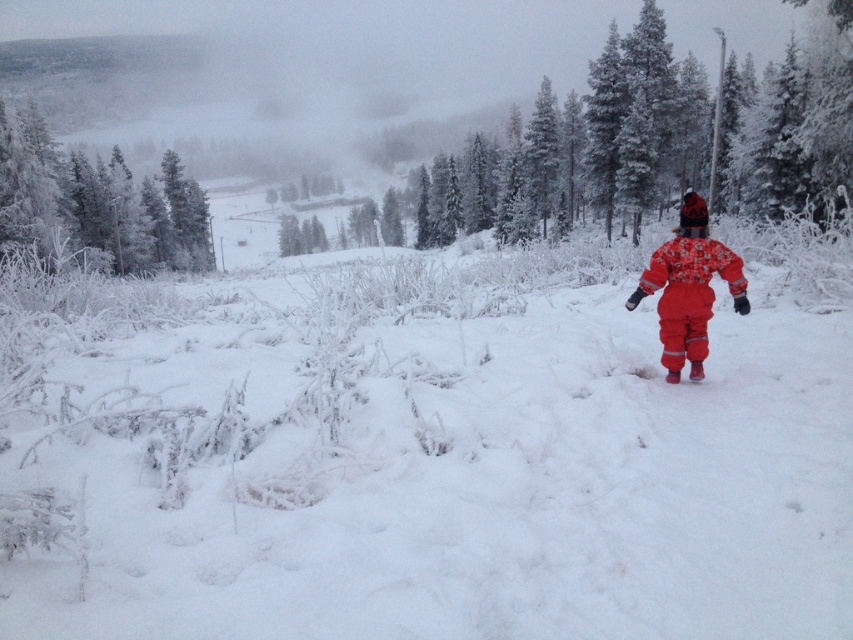
Question: Among these objects, which one is nearest to the camera?

Choices:
 (A) white fluffy snow at center
 (B) fluffy red snowsuit at right
 (C) frosted pine trees at left

Answer: (A)

Question: Does frosted pine trees at left appear under fluffy red snowsuit at right?

Choices:
 (A) no
 (B) yes

Answer: (A)

Question: Is white fluffy snow at center positioned behind frosted pine trees at left?

Choices:
 (A) no
 (B) yes

Answer: (A)

Question: Among these objects, which one is nearest to the camera?

Choices:
 (A) frosted pine trees at left
 (B) fluffy red snowsuit at right

Answer: (B)

Question: Does white fluffy snow at center come behind frosted pine trees at left?

Choices:
 (A) no
 (B) yes

Answer: (A)

Question: Which point is farther from the camera taking this photo?

Choices:
 (A) (669, 372)
 (B) (120, 173)

Answer: (B)